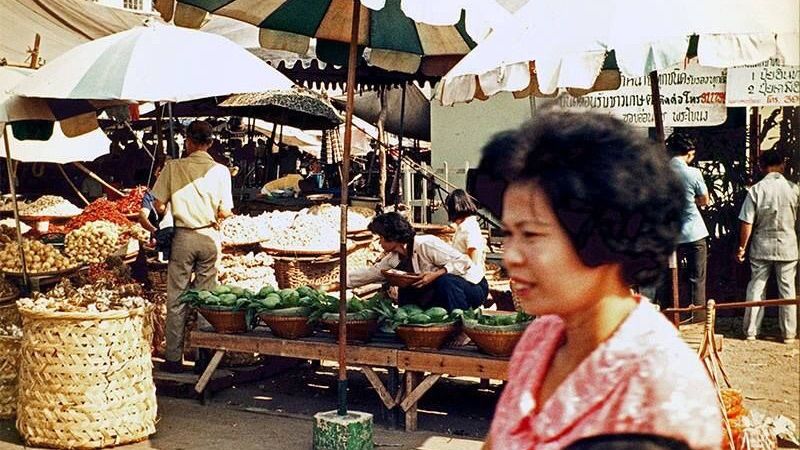
Where is `basket`? basket is located at coordinates (88, 375), (14, 366).